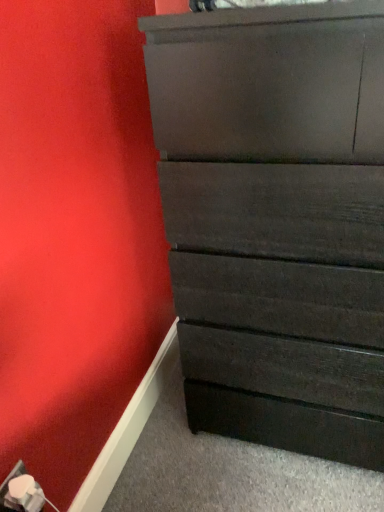
Where is `matte dark wood chest of drawers at center`? matte dark wood chest of drawers at center is located at coordinates (276, 220).

The height and width of the screenshot is (512, 384). What do you see at coordinates (276, 220) in the screenshot? I see `matte dark wood chest of drawers at center` at bounding box center [276, 220].

Identify the location of matte dark wood chest of drawers at center. (276, 220).